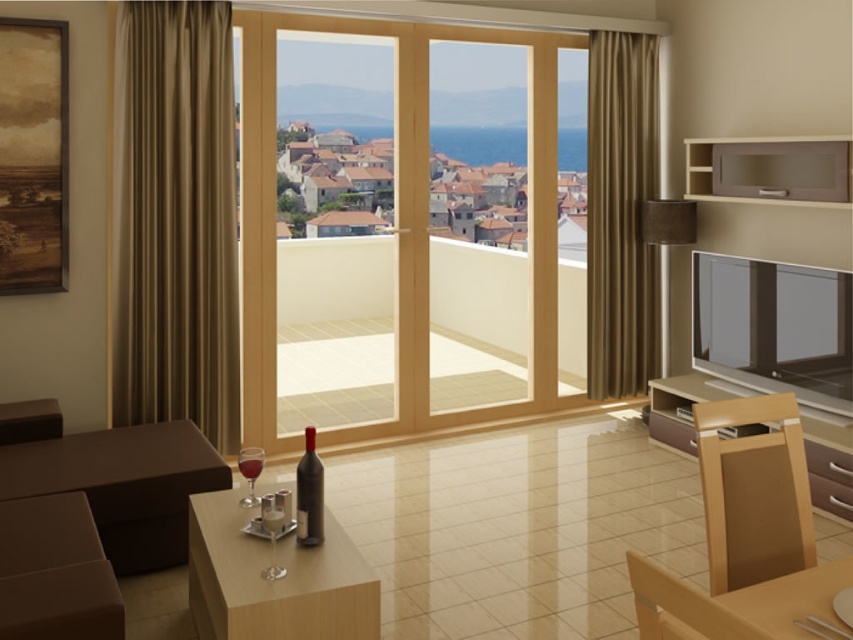
Who is more forward, (805, 577) or (693, 189)?

Positioned in front is point (805, 577).

At what (x,y) coordinates should I click in order to perform the action: click on light brown wooden table at lower right. Please return your answer as a coordinate pair (x, y). Looking at the image, I should click on (791, 598).

This screenshot has width=853, height=640. In order to click on light brown wooden table at lower right in this screenshot , I will do (x=791, y=598).

Who is higher up, brown velvet curtain at right or matte glass microwave at upper right?

Positioned higher is matte glass microwave at upper right.

Who is positioned more to the right, brown velvet curtain at right or matte glass microwave at upper right?

matte glass microwave at upper right

Which is in front, point (637, 298) or point (828, 198)?

Point (828, 198) is more forward.

In order to click on brown velvet curtain at right in this screenshot , I will do tap(619, 212).

Which is above, matte brown chair at lower right or translucent glass wine at lower center?

matte brown chair at lower right is above.

Between point (804, 461) and point (251, 468), which one is positioned behind?

The point (251, 468) is behind.

Locate an element on the screen. Image resolution: width=853 pixels, height=640 pixels. matte brown chair at lower right is located at coordinates (753, 492).